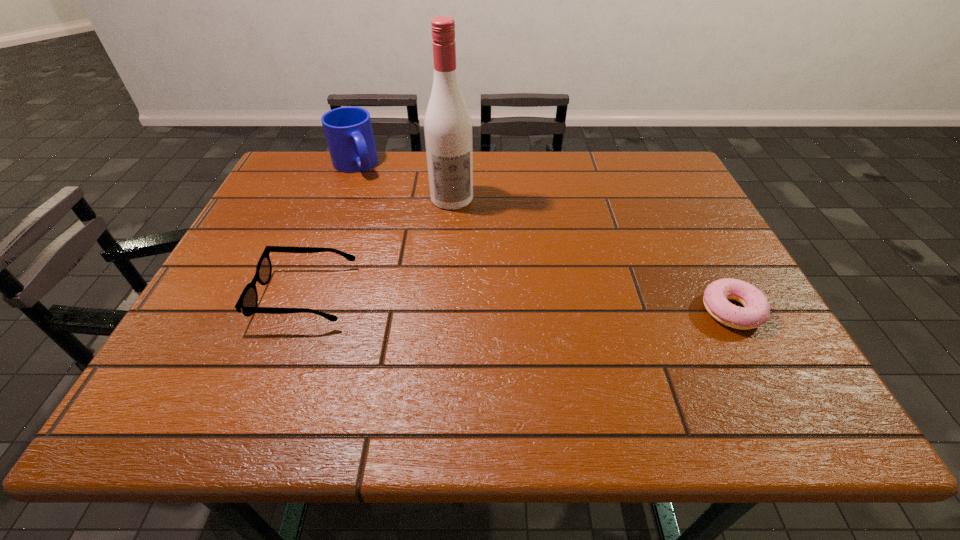
Image resolution: width=960 pixels, height=540 pixels. Identify the location of free space between the tallest object and the mug. (403, 181).

Find the location of a particular element. This screenshot has height=540, width=960. free space between the spectacles and the farthest object is located at coordinates (330, 230).

Locate an element on the screen. Image resolution: width=960 pixels, height=540 pixels. vacant area that lies between the shortest object and the third shortest object is located at coordinates (543, 238).

I want to click on free space that is in between the mug and the third tallest object, so click(x=330, y=230).

Locate an element on the screen. vacant space that's between the spectacles and the farthest object is located at coordinates (330, 230).

Find the location of a particular element. vacant area that lies between the second shortest object and the alcohol is located at coordinates (379, 247).

Locate an element on the screen. This screenshot has height=540, width=960. free space between the spectacles and the shortest object is located at coordinates (518, 303).

Locate an element on the screen. This screenshot has height=540, width=960. free space between the second shortest object and the second object from right to left is located at coordinates (379, 247).

This screenshot has height=540, width=960. I want to click on empty space between the third nearest object and the mug, so click(403, 181).

Find the location of a particular element. The image size is (960, 540). vacant area that lies between the alcohol and the third tallest object is located at coordinates (379, 247).